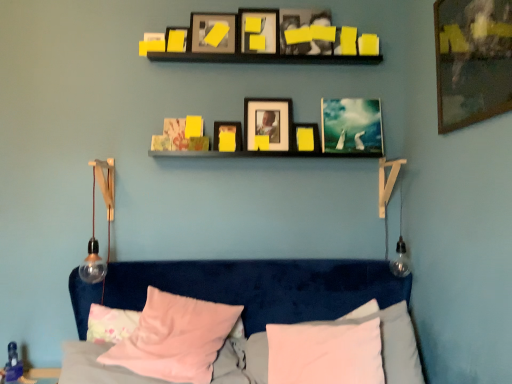
In order to click on pink soft pillow at lower center, acting as the third pillow starting from the left in this screenshot , I will do `click(325, 353)`.

This screenshot has height=384, width=512. Describe the element at coordinates (325, 353) in the screenshot. I see `pink soft pillow at lower center, positioned as the first pillow in right-to-left order` at that location.

Identify the location of pink fabric pillow at lower center, placed as the second pillow when sorted from right to left. (175, 338).

This screenshot has height=384, width=512. What do you see at coordinates (176, 39) in the screenshot?
I see `matte black picture frame at upper left, the 8th picture frame positioned from the back` at bounding box center [176, 39].

How much space does matte black picture frame at center, which is the seventh picture frame from front to back, occupy horizontally?

The width of matte black picture frame at center, which is the seventh picture frame from front to back, is 3.24 inches.

Find the location of a particular element. matte black picture frame at center, which is the seventh picture frame from front to back is located at coordinates (x=267, y=123).

This screenshot has width=512, height=384. Describe the element at coordinates (213, 33) in the screenshot. I see `matte glass picture frame at upper center, which appears as the 3th picture frame when viewed from the front` at that location.

The width and height of the screenshot is (512, 384). Describe the element at coordinates (258, 31) in the screenshot. I see `matte black picture frame at upper center, which is the sixth picture frame from back to front` at that location.

Where is `pink soft pillow at lower center, acting as the third pillow starting from the left`? The width and height of the screenshot is (512, 384). pink soft pillow at lower center, acting as the third pillow starting from the left is located at coordinates (325, 353).

From the image's perspective, starting from the metallic silver picture frame at center, the 1th picture frame in the back-to-front sequence, which picture frame is the 1st one below? Please provide its 2D coordinates.

[(227, 136)]

Is point (227, 147) farther from viewer compared to point (371, 138)?

No, it is not.

Looking at this image, from the image's perspective, is matte yellow picture frame at center, the fourth picture frame from the back, located above or below metallic silver picture frame at center, the ninth picture frame when ordered from front to back?

Clearly, from the image's perspective, matte yellow picture frame at center, the fourth picture frame from the back, is below metallic silver picture frame at center, the ninth picture frame when ordered from front to back.

From a real-world perspective, which object rests below the other?

From a 3D spatial view, matte yellow picture frame at center, the fourth picture frame from the back, is below.

From the image's perspective, between pink soft pillow at lower center, positioned as the first pillow in right-to-left order, and matte black picture frame at upper center, the fifth picture frame when ordered from back to front, who is located below?

pink soft pillow at lower center, positioned as the first pillow in right-to-left order, is shown below in the image.

Is matte black picture frame at upper center, the fifth picture frame when ordered from back to front, located within pink soft pillow at lower center, acting as the third pillow starting from the left?

No, matte black picture frame at upper center, the fifth picture frame when ordered from back to front, is not inside pink soft pillow at lower center, acting as the third pillow starting from the left.

Which is farther, (297, 346) or (329, 18)?

Point (329, 18)

Which object is thinner, pink soft pillow at lower center, acting as the third pillow starting from the left, or matte black picture frame at upper center, the fifth picture frame when ordered from back to front?

With smaller width is matte black picture frame at upper center, the fifth picture frame when ordered from back to front.

Does point (104, 312) come behind point (294, 149)?

No, it is not.

Could you tell me if pink fabric pillow at lower left, which ranks as the 1th pillow in left-to-right order, is turned towards matte black picture frame at center, the eighth picture frame viewed from the front?

No, pink fabric pillow at lower left, which ranks as the 1th pillow in left-to-right order, is not oriented towards matte black picture frame at center, the eighth picture frame viewed from the front.

Would you say pink fabric pillow at lower left, which ranks as the 1th pillow in left-to-right order, is a long distance from matte black picture frame at center, the eighth picture frame viewed from the front?

Yes, pink fabric pillow at lower left, which ranks as the 1th pillow in left-to-right order, is far from matte black picture frame at center, the eighth picture frame viewed from the front.

From a real-world perspective, which is physically above, pink fabric pillow at lower left, which ranks as the 1th pillow in left-to-right order, or matte black picture frame at center, the eighth picture frame viewed from the front?

matte black picture frame at center, the eighth picture frame viewed from the front, is physically above.

Is pink fabric pillow at lower left, the 3th pillow when ordered from right to left, positioned behind pink fabric pillow at lower center, placed as the second pillow when sorted from right to left?

Yes, the depth of pink fabric pillow at lower left, the 3th pillow when ordered from right to left, is greater than that of pink fabric pillow at lower center, placed as the second pillow when sorted from right to left.

Locate an element on the screen. The height and width of the screenshot is (384, 512). pillow that appears above the pink fabric pillow at lower left, the 3th pillow when ordered from right to left (from the image's perspective) is located at coordinates (175, 338).

From a real-world perspective, which is physically below, pink fabric pillow at lower left, which ranks as the 1th pillow in left-to-right order, or pink fabric pillow at lower center, which appears as the second pillow when viewed from the left?

pink fabric pillow at lower left, which ranks as the 1th pillow in left-to-right order, from a real-world perspective.

Does pink fabric pillow at lower left, which ranks as the 1th pillow in left-to-right order, contain pink fabric pillow at lower center, which appears as the second pillow when viewed from the left?

No, pink fabric pillow at lower center, which appears as the second pillow when viewed from the left, is not a part of pink fabric pillow at lower left, which ranks as the 1th pillow in left-to-right order.

How far apart are pink fabric pillow at lower center, placed as the second pillow when sorted from right to left, and matte black picture frame at upper left, the 8th picture frame positioned from the back?

They are 4.34 feet apart.

Does pink fabric pillow at lower center, placed as the second pillow when sorted from right to left, turn towards matte black picture frame at upper left, the second picture frame positioned from the front?

No, pink fabric pillow at lower center, placed as the second pillow when sorted from right to left, is not oriented towards matte black picture frame at upper left, the second picture frame positioned from the front.

Does pink fabric pillow at lower center, which appears as the second pillow when viewed from the left, have a lesser height compared to matte black picture frame at upper left, the 8th picture frame positioned from the back?

Incorrect, the height of pink fabric pillow at lower center, which appears as the second pillow when viewed from the left, does not fall short of that of matte black picture frame at upper left, the 8th picture frame positioned from the back.

From the picture: Considering the positions of objects pink soft pillow at lower center, positioned as the first pillow in right-to-left order, and pink fabric pillow at lower center, which appears as the second pillow when viewed from the left, in the image provided, who is more to the left, pink soft pillow at lower center, positioned as the first pillow in right-to-left order, or pink fabric pillow at lower center, which appears as the second pillow when viewed from the left,?

pink fabric pillow at lower center, which appears as the second pillow when viewed from the left.

Between pink soft pillow at lower center, acting as the third pillow starting from the left, and pink fabric pillow at lower center, placed as the second pillow when sorted from right to left, which one has smaller width?

Thinner between the two is pink soft pillow at lower center, acting as the third pillow starting from the left.

Considering the relative positions of pink soft pillow at lower center, acting as the third pillow starting from the left, and pink fabric pillow at lower center, placed as the second pillow when sorted from right to left, in the image provided, is pink soft pillow at lower center, acting as the third pillow starting from the left, behind pink fabric pillow at lower center, placed as the second pillow when sorted from right to left,?

No, it is in front of pink fabric pillow at lower center, placed as the second pillow when sorted from right to left.

Is matte black picture frame at upper center, the fifth picture frame viewed from the front, completely or partially inside matte black picture frame at center, positioned as the third picture frame in back-to-front order?

No, matte black picture frame at upper center, the fifth picture frame viewed from the front, is not a part of matte black picture frame at center, positioned as the third picture frame in back-to-front order.

From the image's perspective, is matte black picture frame at center, positioned as the third picture frame in back-to-front order, below matte black picture frame at upper center, the fifth picture frame when ordered from back to front?

Correct, matte black picture frame at center, positioned as the third picture frame in back-to-front order, appears lower than matte black picture frame at upper center, the fifth picture frame when ordered from back to front, in the image.

Can you confirm if matte black picture frame at center, which is the seventh picture frame from front to back, is bigger than matte black picture frame at upper center, the fifth picture frame viewed from the front?

Correct, matte black picture frame at center, which is the seventh picture frame from front to back, is larger in size than matte black picture frame at upper center, the fifth picture frame viewed from the front.

Is matte black picture frame at center, which is the seventh picture frame from front to back, facing away from matte black picture frame at upper center, the fifth picture frame when ordered from back to front?

That's not correct — matte black picture frame at center, which is the seventh picture frame from front to back, is not looking away from matte black picture frame at upper center, the fifth picture frame when ordered from back to front.

The width and height of the screenshot is (512, 384). What are the coordinates of `the 3rd picture frame behind when counting from the matte yellow picture frame at center, the fourth picture frame from the back` in the screenshot? It's located at (351, 126).

What are the coordinates of `pillow lying on the right of matte black picture frame at upper center, the fifth picture frame viewed from the front` in the screenshot? It's located at (325, 353).

Based on their spatial positions, is matte black picture frame at upper center, the fourth picture frame in the front-to-back sequence, or pink soft pillow at lower center, acting as the third pillow starting from the left, closer to matte yellow picture frame at center, which is counted as the 6th picture frame, starting from the front?

The object closer to matte yellow picture frame at center, which is counted as the 6th picture frame, starting from the front, is matte black picture frame at upper center, the fourth picture frame in the front-to-back sequence.

Looking at the image, which one is located further to pink soft pillow at lower center, acting as the third pillow starting from the left, wooden framed artwork at upper right, placed as the 9th picture frame when sorted from back to front, or pink fabric pillow at lower left, the 3th pillow when ordered from right to left?

Among the two, wooden framed artwork at upper right, placed as the 9th picture frame when sorted from back to front, is located further to pink soft pillow at lower center, acting as the third pillow starting from the left.

When comparing their distances from matte glass picture frame at upper center, which appears as the 7th picture frame when viewed from the back, does matte black picture frame at upper center, the fifth picture frame viewed from the front, or matte black picture frame at center, the 2th picture frame when ordered from back to front, seem further?

matte black picture frame at center, the 2th picture frame when ordered from back to front, is further to matte glass picture frame at upper center, which appears as the 7th picture frame when viewed from the back.

Considering their positions, is pink soft pillow at lower center, acting as the third pillow starting from the left, positioned further to clear glass bulb at left than pink fabric pillow at lower center, which appears as the second pillow when viewed from the left?

Among the two, pink soft pillow at lower center, acting as the third pillow starting from the left, is located further to clear glass bulb at left.

Estimate the real-world distances between objects in this image. Which object is closer to pink fabric pillow at lower center, placed as the second pillow when sorted from right to left, matte black picture frame at upper center, which is the sixth picture frame from back to front, or pink fabric pillow at lower left, the 3th pillow when ordered from right to left?

pink fabric pillow at lower left, the 3th pillow when ordered from right to left, is closer to pink fabric pillow at lower center, placed as the second pillow when sorted from right to left.

From the image, which object appears to be farther from matte yellow picture frame at center, which is counted as the 6th picture frame, starting from the front, matte black picture frame at upper center, which is the sixth picture frame from back to front, or matte black picture frame at upper left, the second picture frame positioned from the front?

matte black picture frame at upper left, the second picture frame positioned from the front.

Which object lies nearer to the anchor point matte black picture frame at center, which is the seventh picture frame from front to back, matte black picture frame at center, the eighth picture frame viewed from the front, or matte yellow picture frame at center, the fourth picture frame from the back?

Among the two, matte yellow picture frame at center, the fourth picture frame from the back, is located nearer to matte black picture frame at center, which is the seventh picture frame from front to back.

Consider the image. From the image, which object appears to be nearer to matte black picture frame at upper center, the fifth picture frame when ordered from back to front, matte black picture frame at upper left, the second picture frame positioned from the front, or matte black picture frame at upper center, which is the sixth picture frame from back to front?

matte black picture frame at upper center, which is the sixth picture frame from back to front, lies closer to matte black picture frame at upper center, the fifth picture frame when ordered from back to front, than the other object.

Find the location of `lamp between matte glass picture frame at upper center, which appears as the 7th picture frame when viewed from the back, and pink soft pillow at lower center, acting as the third pillow starting from the left, in the vertical direction`. lamp between matte glass picture frame at upper center, which appears as the 7th picture frame when viewed from the back, and pink soft pillow at lower center, acting as the third pillow starting from the left, in the vertical direction is located at coordinates (95, 241).

Locate an element on the screen. The width and height of the screenshot is (512, 384). pillow between matte black picture frame at center, the 2th picture frame when ordered from back to front, and pink fabric pillow at lower left, which ranks as the 1th pillow in left-to-right order, in the up-down direction is located at coordinates (175, 338).

The width and height of the screenshot is (512, 384). What are the coordinates of `lamp between matte black picture frame at upper center, which is the sixth picture frame from back to front, and pink soft pillow at lower center, positioned as the first pillow in right-to-left order, vertically` in the screenshot? It's located at (95, 241).

Where is `pillow that lies between matte black picture frame at upper center, the fourth picture frame in the front-to-back sequence, and pink fabric pillow at lower left, which ranks as the 1th pillow in left-to-right order, from top to bottom`? pillow that lies between matte black picture frame at upper center, the fourth picture frame in the front-to-back sequence, and pink fabric pillow at lower left, which ranks as the 1th pillow in left-to-right order, from top to bottom is located at coordinates (175, 338).